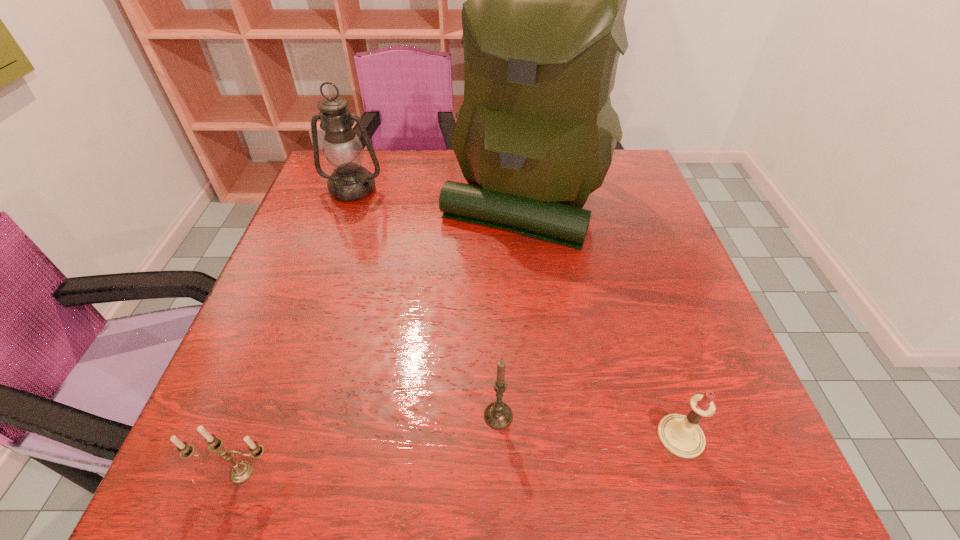
Where is `object that is at the near right corner`? object that is at the near right corner is located at coordinates (681, 435).

This screenshot has width=960, height=540. I want to click on blank space at the far edge of the desktop, so click(x=381, y=164).

Identify the location of vacant space at the near edge of the desktop. The image size is (960, 540). (552, 456).

I want to click on blank space at the left edge of the desktop, so click(x=302, y=368).

The height and width of the screenshot is (540, 960). I want to click on free space at the right edge of the desktop, so click(x=600, y=202).

I want to click on vacant space at the near left corner, so click(275, 485).

You are a GUI agent. You are given a task and a screenshot of the screen. Output one action in this format:
    pyautogui.click(x=<x>, y=<y>)
    Task: Click on the vacant space at the far right corner of the desktop
    The height and width of the screenshot is (540, 960).
    Given the screenshot: What is the action you would take?
    pyautogui.click(x=617, y=152)

Where is `vacant space that's between the rightmost candle and the backpack`? This screenshot has width=960, height=540. vacant space that's between the rightmost candle and the backpack is located at coordinates (602, 317).

Where is `free spot between the oil lamp and the leftmost candle`? The width and height of the screenshot is (960, 540). free spot between the oil lamp and the leftmost candle is located at coordinates (298, 330).

This screenshot has width=960, height=540. In order to click on free spot between the second tallest object and the rightmost candle in this screenshot , I will do pos(516,313).